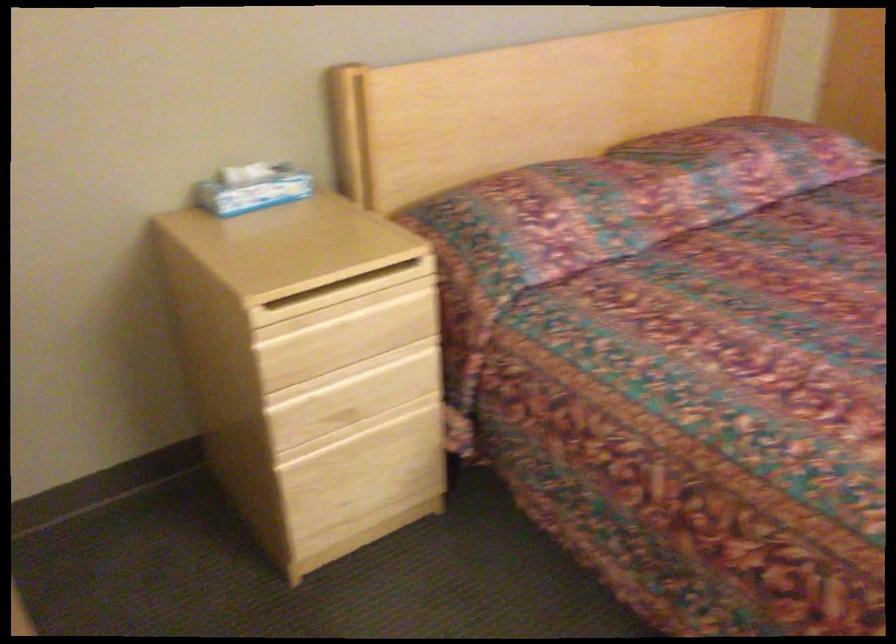
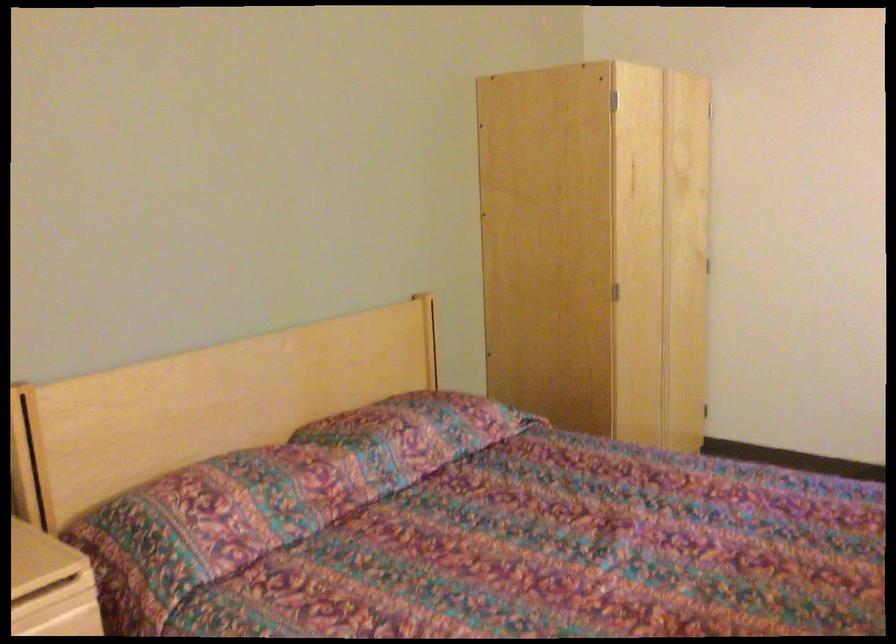
The images are taken continuously from a first-person perspective. In which direction is your viewpoint rotating?

The camera's rotation is toward right-up.